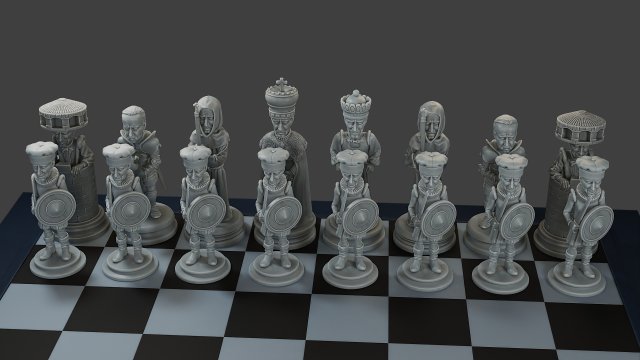
Where is `playing board`? Image resolution: width=640 pixels, height=360 pixels. playing board is located at coordinates (301, 336).